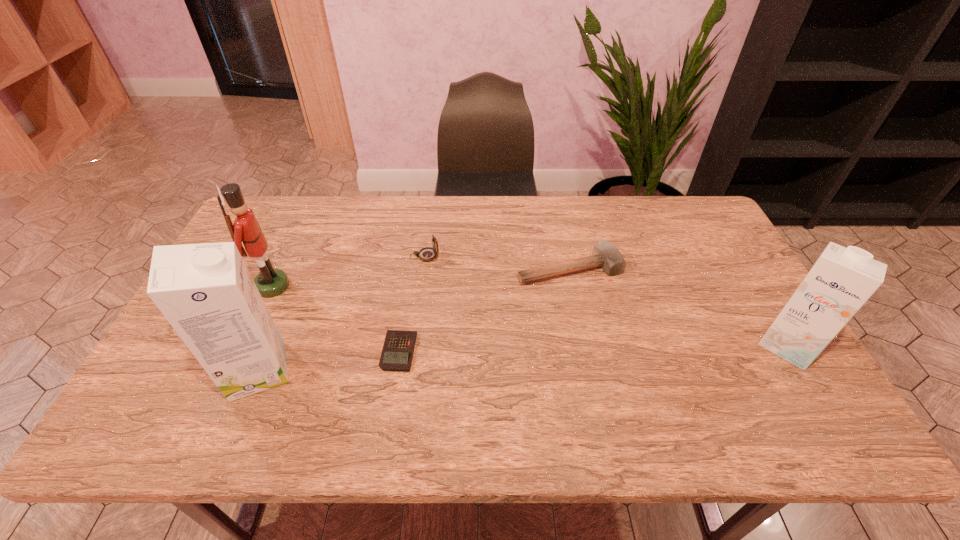
Locate an element on the screen. The height and width of the screenshot is (540, 960). vacant spot for a new carton to ensure equal spacing is located at coordinates (530, 357).